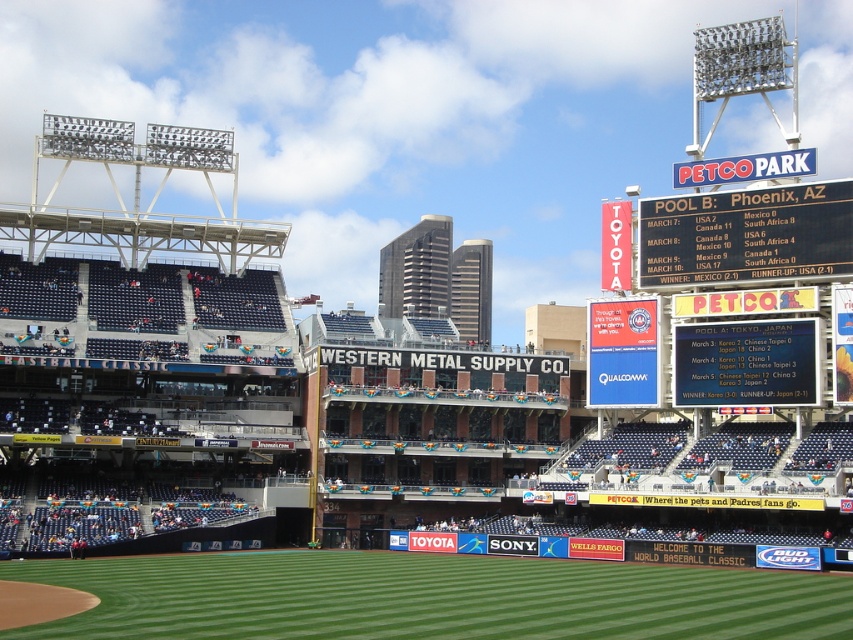
Based on the photo, you are a photographer standing at the edge of the baseball field. You want to capture a photo that includes both the green grass at lower center and the white plastic scoreboard at upper right. Based on their positions, where should you position your camera to ensure both elements are in the frame?

Since the green grass at lower center is located below the white plastic scoreboard at upper right, you should position your camera at a lower angle to include both elements in the frame.

You are a photographer positioned at the center of the baseball field at Petco Park. You want to capture a shot that includes both the green grass at lower center and the white plastic scoreboard at upper right. Given that your camera has a focal length of 50mm, which is suitable for capturing objects within a 20 meter range, will you be able to frame both objects in a single shot?

The green grass at lower center is 20.12 meters away from the white plastic scoreboard at upper right. Since the distance between them is slightly over 20 meters, the camera with a 50mm focal length might struggle to capture both in a single shot as it is optimized for objects within 20 meters.